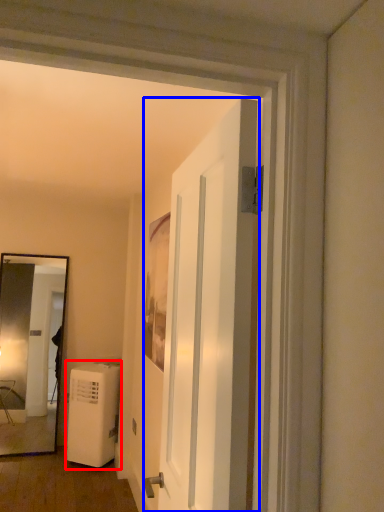
Question: Which object appears closest to the camera in this image, air conditioner (highlighted by a red box) or door (highlighted by a blue box)?

Choices:
 (A) air conditioner
 (B) door

Answer: (B)